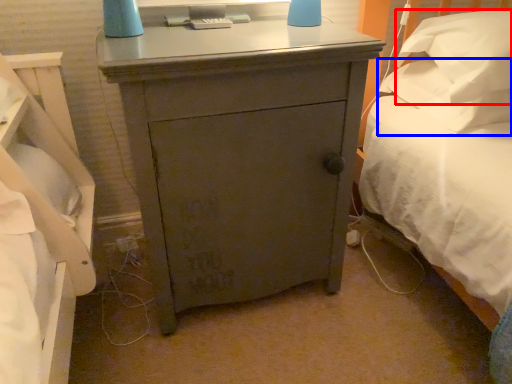
Question: Which object appears closest to the camera in this image, pillow (highlighted by a red box) or pillow (highlighted by a blue box)?

Choices:
 (A) pillow
 (B) pillow

Answer: (A)